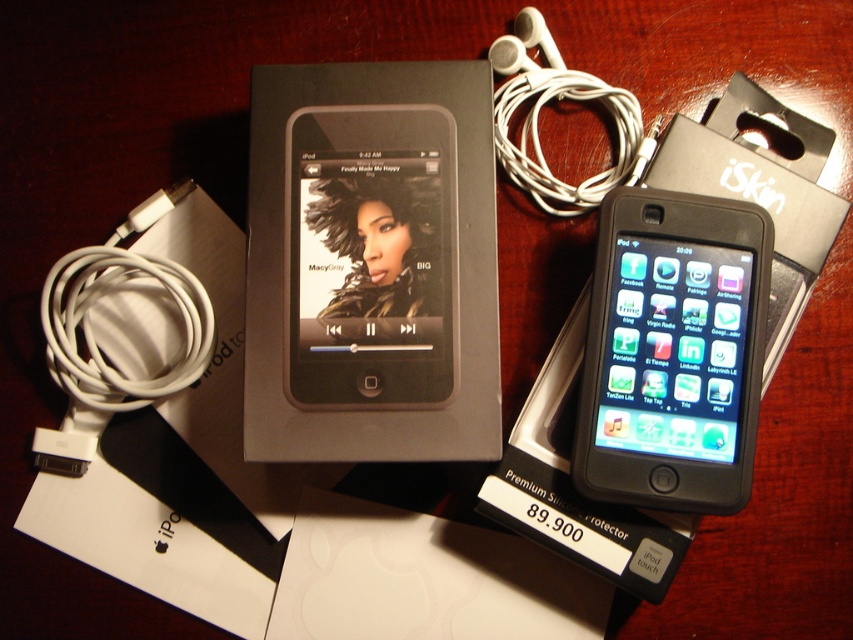
Does black matte ipod at center lie in front of black matte ipod at upper center?

No, it is behind black matte ipod at upper center.

At what (x,y) coordinates should I click in order to perform the action: click on black matte ipod at center. Please return your answer as a coordinate pair (x, y). Looking at the image, I should click on (370, 264).

At what (x,y) coordinates should I click in order to perform the action: click on black matte ipod at center. Please return your answer as a coordinate pair (x, y). Looking at the image, I should click on (370, 264).

Is black matte ipod at center below white rubber cable at lower left?

No.

Who is more distant from viewer, (248, 348) or (99, 419)?

Positioned behind is point (99, 419).

Locate an element on the screen. This screenshot has width=853, height=640. black matte ipod at center is located at coordinates (370, 264).

Who is taller, black matte ipod at upper center or white rubber cable at lower left?

black matte ipod at upper center

Measure the distance between point (x=721, y=419) and camera.

They are 77.20 centimeters apart.

This screenshot has width=853, height=640. Identify the location of black matte ipod at upper center. (672, 352).